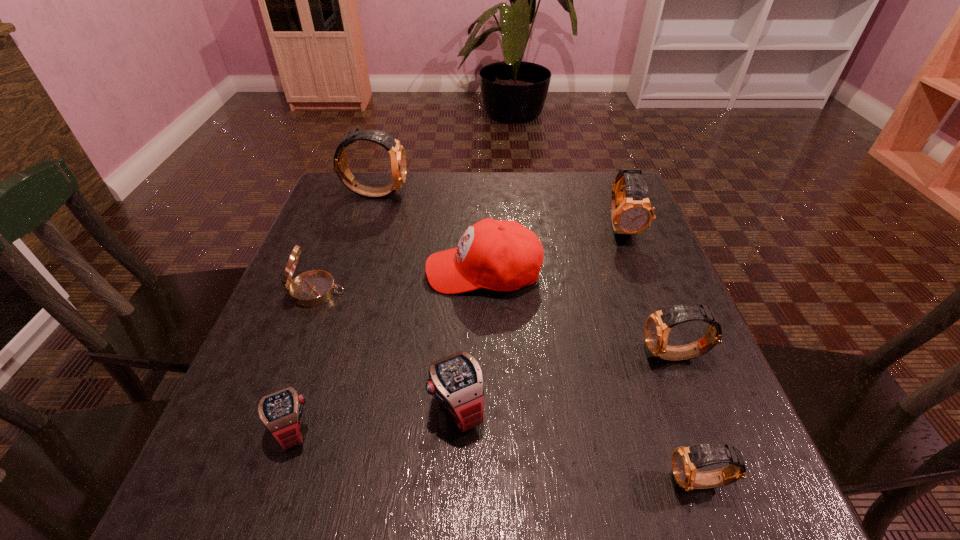
Where is `object that is at the near left corner`? The height and width of the screenshot is (540, 960). object that is at the near left corner is located at coordinates (281, 412).

This screenshot has height=540, width=960. What are the coordinates of `object that is positioned at the far right corner` in the screenshot? It's located at (631, 212).

Where is `object located in the near right corner section of the desktop`? object located in the near right corner section of the desktop is located at coordinates (686, 461).

Find the location of a particular element. vacant area at the far edge is located at coordinates (386, 213).

Where is `free region at the near edge of the desktop`? Image resolution: width=960 pixels, height=540 pixels. free region at the near edge of the desktop is located at coordinates tap(416, 464).

In the image, there is a desktop. Identify the location of vacant space at the left edge. (281, 298).

Locate an element on the screen. The height and width of the screenshot is (540, 960). vacant space at the right edge of the desktop is located at coordinates (656, 249).

Where is `vacant region at the near left corner`? Image resolution: width=960 pixels, height=540 pixels. vacant region at the near left corner is located at coordinates (218, 457).

In the image, there is a desktop. Where is `vacant space at the far right corner`? vacant space at the far right corner is located at coordinates (597, 201).

Where is `unoccupied area between the nearest object and the farthest object`? The image size is (960, 540). unoccupied area between the nearest object and the farthest object is located at coordinates (538, 338).